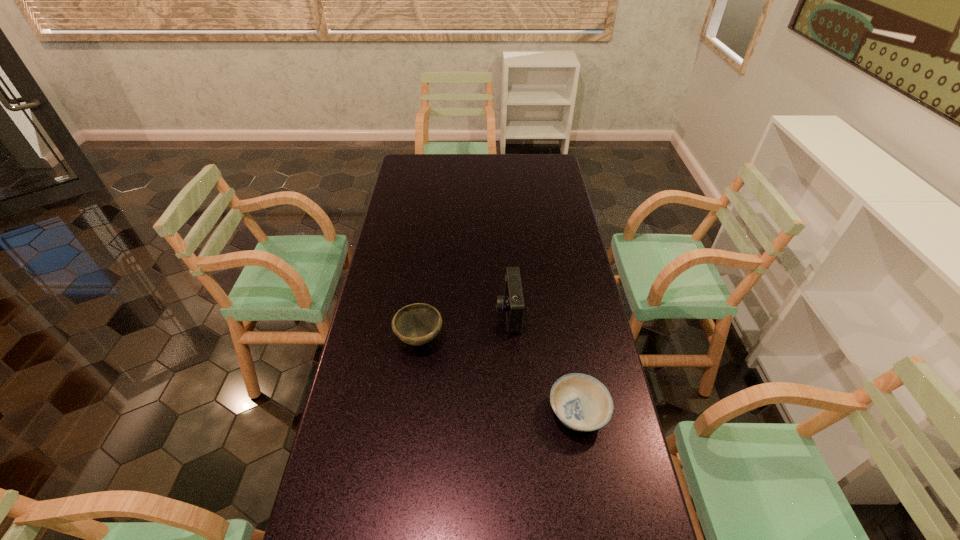
This screenshot has height=540, width=960. Find the location of `empty space that is in between the taller bowl and the camera`. empty space that is in between the taller bowl and the camera is located at coordinates (464, 326).

Where is `vacant space that is in between the second object from right to left and the taller bowl`? vacant space that is in between the second object from right to left and the taller bowl is located at coordinates (464, 326).

The image size is (960, 540). In order to click on free space between the second object from left to right and the taller bowl in this screenshot , I will do `click(464, 326)`.

Locate an element on the screen. free space between the camera and the taller bowl is located at coordinates (464, 326).

This screenshot has height=540, width=960. In order to click on empty space between the nearer bowl and the camera in this screenshot , I will do `click(543, 363)`.

In order to click on the second closest object relative to the shortest object in this screenshot , I will do `click(416, 324)`.

Select which object is the second closest to the farther bowl. Please provide its 2D coordinates. Your answer should be formatted as a tuple, i.e. [(x, y)], where the tuple contains the x and y coordinates of a point satisfying the conditions above.

[(581, 402)]

Locate an element on the screen. The image size is (960, 540). free spot that satisfies the following two spatial constraints: 1. on the front-facing side of the nearer bowl; 2. on the left side of the second object from right to left is located at coordinates (515, 413).

Locate an element on the screen. The image size is (960, 540). blank area in the image that satisfies the following two spatial constraints: 1. on the front-facing side of the right bowl; 2. on the right side of the camera is located at coordinates (515, 413).

Locate an element on the screen. vacant space that satisfies the following two spatial constraints: 1. on the front-facing side of the second object from left to right; 2. on the right side of the shortest object is located at coordinates (515, 413).